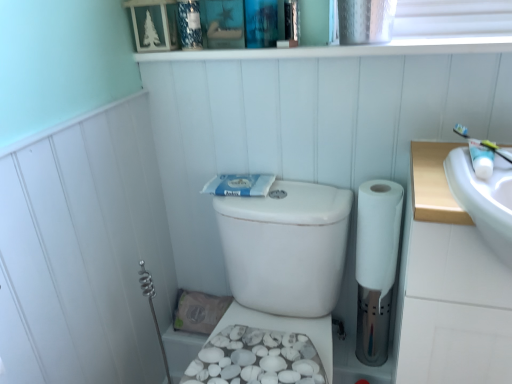
Question: Considering the positions of white glossy toothpaste tube at upper right, the 2th toiletry from the back, and blue textured candle at upper center, the 2th toiletry viewed from the right, in the image, is white glossy toothpaste tube at upper right, the 2th toiletry from the back, taller or shorter than blue textured candle at upper center, the 2th toiletry viewed from the right,?

Choices:
 (A) tall
 (B) short

Answer: (B)

Question: Is white glossy toothpaste tube at upper right, the 2th toiletry from the back, inside the boundaries of blue textured candle at upper center, marked as the 1th toiletry in a back-to-front arrangement, or outside?

Choices:
 (A) outside
 (B) inside

Answer: (A)

Question: Which of these objects is positioned closest to the white textured bidet at lower center?

Choices:
 (A) white glossy toothpaste tube at upper right, the 2th toiletry viewed from the top
 (B) white matte toilet paper at right
 (C) blue matte toothpaste at center
 (D) blue textured candle at upper center, the first toiletry viewed from the top
 (E) white plastic toothbrush at upper right

Answer: (B)

Question: Which of these objects is positioned closest to the white glossy ledge at upper center?

Choices:
 (A) blue textured candle at upper center, marked as the 1th toiletry in a back-to-front arrangement
 (B) white glossy toothpaste tube at upper right, which ranks as the first toiletry in bottom-to-top order
 (C) white matte toilet paper at right
 (D) blue matte toothpaste at center
 (E) white plastic toothbrush at upper right

Answer: (A)